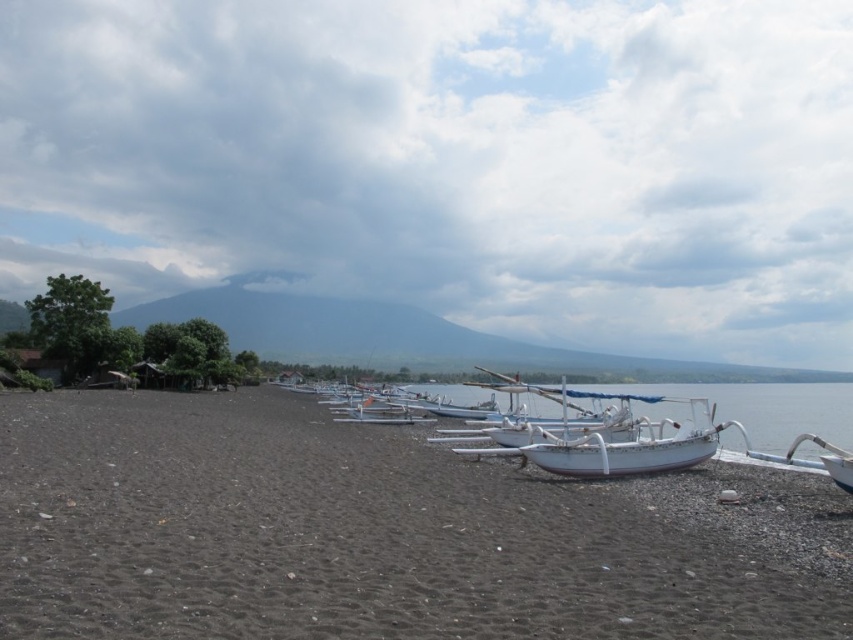
Is dark brown gravel at center positioned before white glossy boat at center?

That is True.

Between dark brown gravel at center and white glossy boat at center, which one appears on the right side from the viewer's perspective?

white glossy boat at center is more to the right.

Is point (421, 520) less distant than point (671, 426)?

Yes, it is in front of point (671, 426).

Find the location of a particular element. dark brown gravel at center is located at coordinates (355, 536).